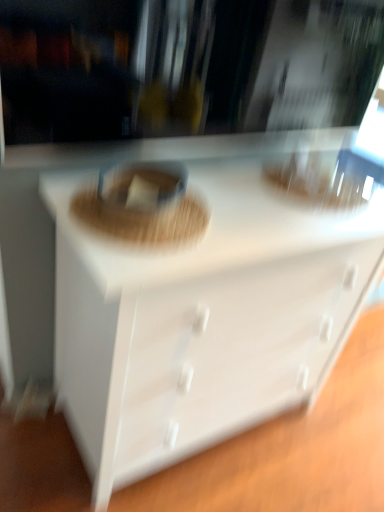
Identify the location of vacant location below brown woven basket at center (from a real-world perspective). Image resolution: width=384 pixels, height=512 pixels. (146, 208).